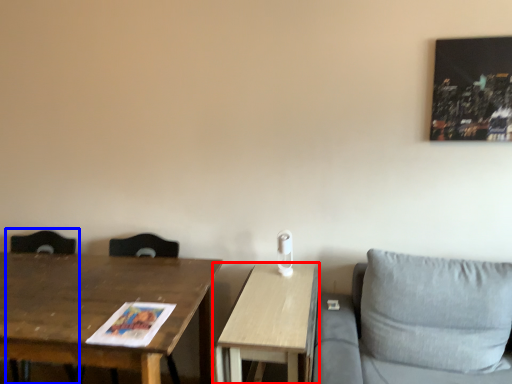
Question: Among these objects, which one is nearest to the camera, table (highlighted by a red box) or swivel chair (highlighted by a blue box)?

Choices:
 (A) table
 (B) swivel chair

Answer: (A)